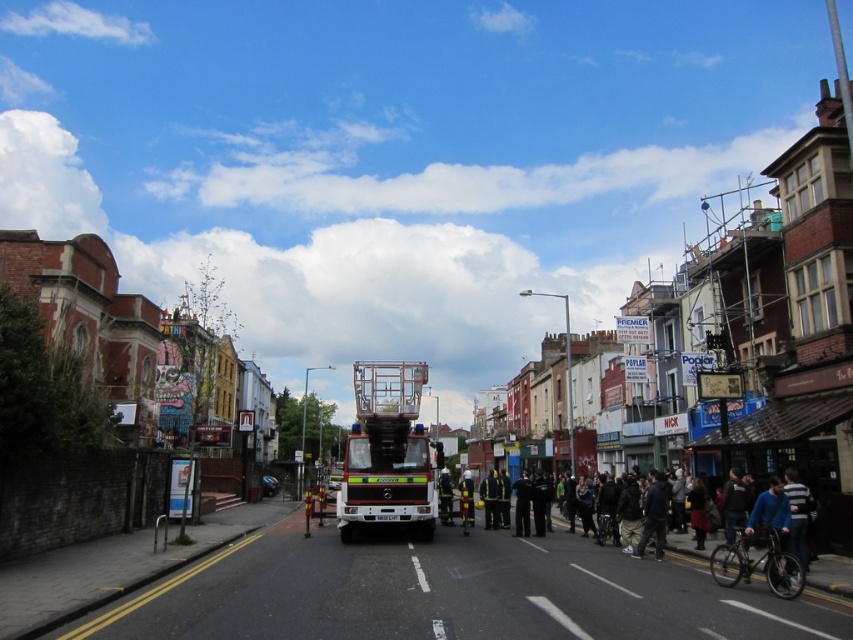
Question: Based on their relative distances, which object is farther from the metallic silver fire truck at center?

Choices:
 (A) reflective yellow jacket at center
 (B) reflective yellow uniform at center

Answer: (A)

Question: Among these objects, which one is nearest to the camera?

Choices:
 (A) reflective yellow uniform at center
 (B) reflective silver helmet at center

Answer: (B)

Question: Based on their relative distances, which object is nearer to the reflective yellow uniform at center?

Choices:
 (A) reflective yellow jacket at center
 (B) metallic silver fire truck at center
 (C) dark blue jeans at center

Answer: (A)

Question: Is metallic silver fire truck at center closer to camera compared to reflective silver helmet at center?

Choices:
 (A) yes
 (B) no

Answer: (A)

Question: Where is dark blue jeans at center located in relation to reflective yellow jacket at center in the image?

Choices:
 (A) left
 (B) right

Answer: (B)

Question: Is reflective yellow uniform at center below reflective silver helmet at center?

Choices:
 (A) no
 (B) yes

Answer: (B)